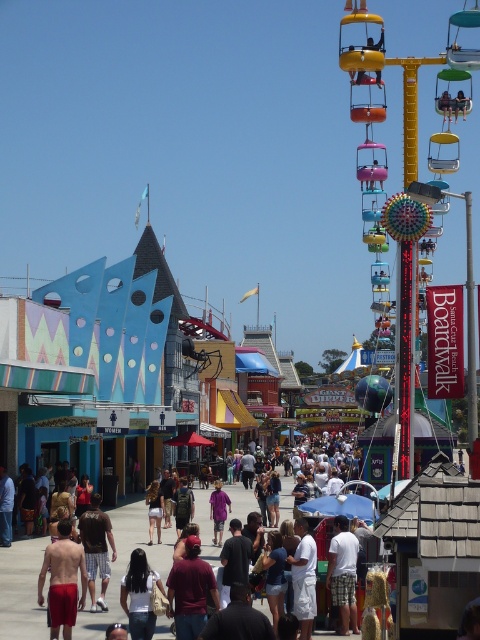
You are a photographer trying to capture both the red matte shorts at lower left and the white cotton shirt at center in a single frame. Considering their heights, which object should you focus on to ensure both are visible without cropping?

The red matte shorts at lower left is much taller than the white cotton shirt at center, so you should focus on the red matte shorts at lower left to ensure both are visible in the frame.

You are standing at the entrance of the Santa Cruz Beach Boardwalk and see a person wearing a white cotton shirt at center. If you want to find this person, which direction should you look relative to your current position?

The white cotton shirt at center is located at coordinates approximately 0.897 on the x axis and 0.715 on the y axis, so you should look towards the center area of the boardwalk to find the person wearing the white cotton shirt at center.